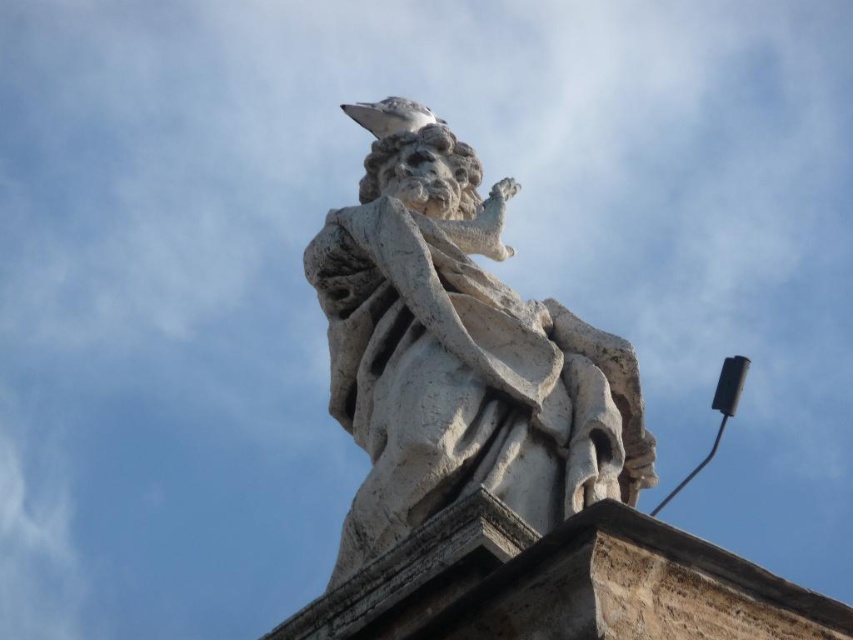
Consider the image. You are a photographer trying to capture the white stone statue at center and the white matte pigeon at upper center in the same frame. Based on their positions, which object should you adjust your camera to focus on first to ensure both are in the frame?

The white stone statue at center is positioned on the right side of white matte pigeon at upper center, so you should focus on the white matte pigeon at upper center first to ensure both are in the frame.

You are an architect designing a new rooftop garden and want to place a bird feeder. You see the white stone statue at center and the white matte pigeon at upper center in the image. Which object is closer to you, the architect, from your current viewpoint?

The white stone statue at center is closer to you than the white matte pigeon at upper center because it is positioned in front of it.